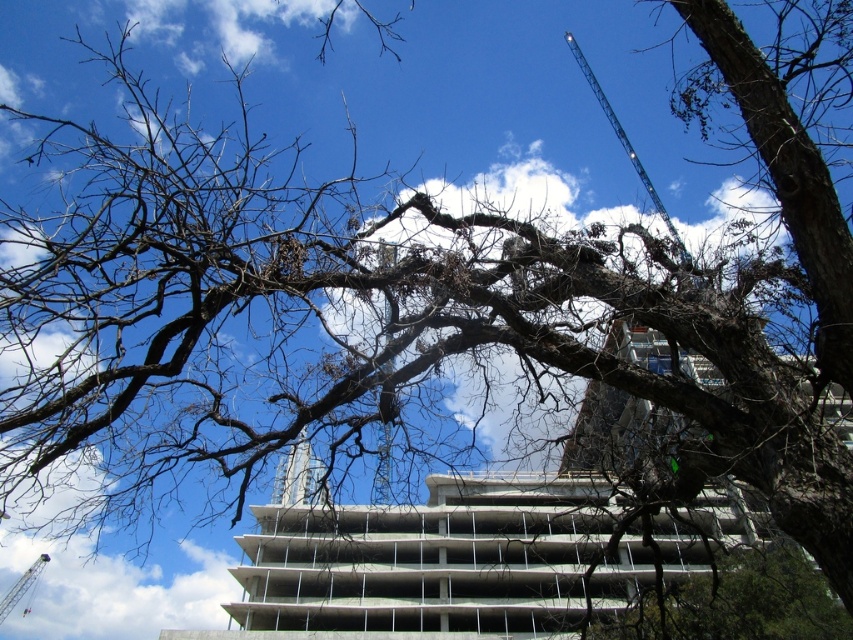
Can you confirm if blue metallic crane at upper center is positioned below metallic blue crane at lower left?

No, blue metallic crane at upper center is not below metallic blue crane at lower left.

Which is more to the right, blue metallic crane at upper center or metallic blue crane at lower left?

From the viewer's perspective, blue metallic crane at upper center appears more on the right side.

Between point (680, 252) and point (28, 572), which one is positioned behind?

The point (28, 572) is more distant.

Identify the location of blue metallic crane at upper center. (625, 145).

Does white concrete tower at center appear on the right side of blue metallic crane at upper center?

Incorrect, white concrete tower at center is not on the right side of blue metallic crane at upper center.

In the scene shown: Can you confirm if white concrete tower at center is wider than blue metallic crane at upper center?

In fact, white concrete tower at center might be narrower than blue metallic crane at upper center.

Does point (283, 502) lie in front of point (582, 72)?

Yes, point (283, 502) is in front of point (582, 72).

Locate an element on the screen. The height and width of the screenshot is (640, 853). white concrete tower at center is located at coordinates (299, 476).

Is point (294, 492) positioned in front of point (20, 577)?

Yes, it is in front of point (20, 577).

Is point (300, 499) closer to camera compared to point (28, 579)?

Yes, point (300, 499) is closer to viewer.

Where is `white concrete tower at center`? This screenshot has width=853, height=640. white concrete tower at center is located at coordinates (299, 476).